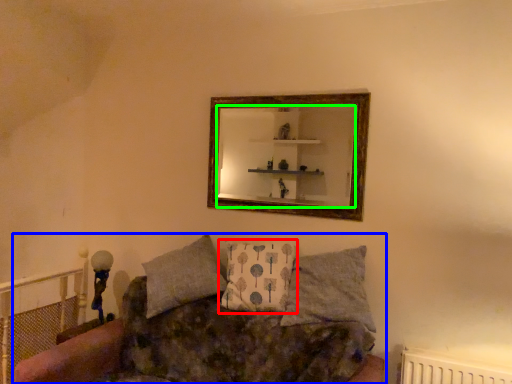
Question: Based on their relative distances, which object is nearer to pillow (highlighted by a red box)? Choose from studio couch (highlighted by a blue box) and mirror (highlighted by a green box).

Choices:
 (A) studio couch
 (B) mirror

Answer: (A)